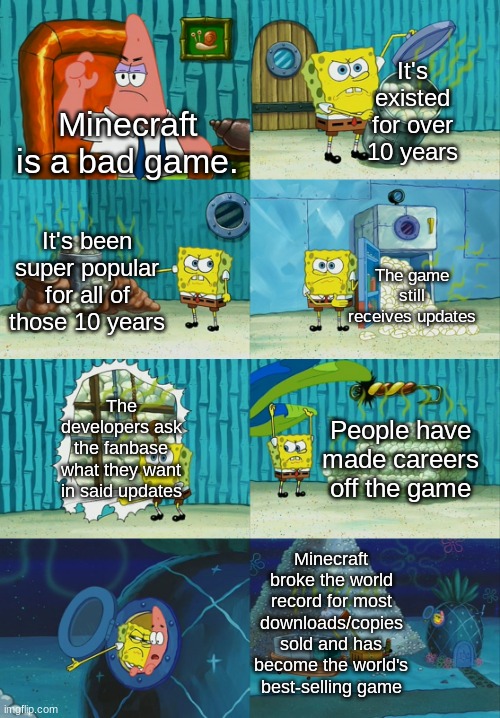
This screenshot has width=500, height=718. In order to click on blue and green blanket in this screenshot , I will do `click(295, 383)`.